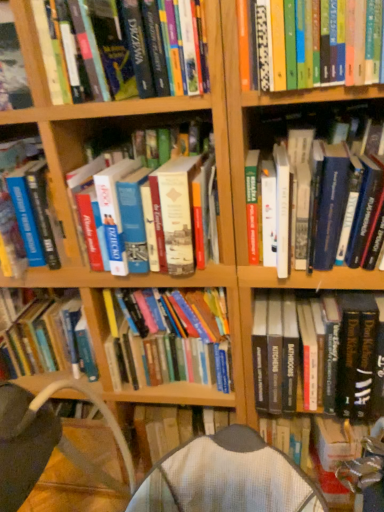
Question: From a real-world perspective, is hardcover book at upper right, which appears as the 5th book when viewed from the left, on top of hardcover book at center, which appears as the 2th book when viewed from the right?

Choices:
 (A) no
 (B) yes

Answer: (B)

Question: Is hardcover book at upper right, which is the third book in right-to-left order, oriented towards hardcover book at center, which appears as the 6th book when viewed from the left?

Choices:
 (A) yes
 (B) no

Answer: (B)

Question: Considering the relative sizes of hardcover book at upper right, which is the third book in right-to-left order, and hardcover book at center, which appears as the 2th book when viewed from the right, in the image provided, is hardcover book at upper right, which is the third book in right-to-left order, wider than hardcover book at center, which appears as the 2th book when viewed from the right,?

Choices:
 (A) yes
 (B) no

Answer: (A)

Question: Is hardcover book at upper right, which is the third book in right-to-left order, oriented away from hardcover book at center, which appears as the 2th book when viewed from the right?

Choices:
 (A) no
 (B) yes

Answer: (A)

Question: From a real-world perspective, is hardcover book at upper right, which appears as the 5th book when viewed from the left, beneath hardcover book at center, which appears as the 2th book when viewed from the right?

Choices:
 (A) no
 (B) yes

Answer: (A)

Question: Is hardcover book at upper right, which is the third book in right-to-left order, taller than hardcover book at center, which appears as the 2th book when viewed from the right?

Choices:
 (A) yes
 (B) no

Answer: (B)

Question: Is hardcover book at left, the first book viewed from the left, located outside hardcover book at lower right, the 1th book positioned from the right?

Choices:
 (A) no
 (B) yes

Answer: (B)

Question: Is hardcover book at left, the seventh book from the right, taller than hardcover book at lower right, the 1th book positioned from the right?

Choices:
 (A) no
 (B) yes

Answer: (A)

Question: From the image's perspective, is hardcover book at left, the first book viewed from the left, under hardcover book at lower right, acting as the seventh book starting from the left?

Choices:
 (A) no
 (B) yes

Answer: (A)

Question: Is hardcover book at left, the seventh book from the right, not near hardcover book at lower right, the 1th book positioned from the right?

Choices:
 (A) no
 (B) yes

Answer: (A)

Question: Is hardcover book at left, the seventh book from the right, to the right of hardcover book at lower right, acting as the seventh book starting from the left, from the viewer's perspective?

Choices:
 (A) yes
 (B) no

Answer: (B)

Question: Is hardcover book at left, the first book viewed from the left, placed right next to hardcover book at lower right, the 1th book positioned from the right?

Choices:
 (A) no
 (B) yes

Answer: (A)

Question: Considering the relative sizes of hardcover book at center, which appears as the 2th book when viewed from the right, and hardcover book at center, which is the fourth book from left to right, in the image provided, is hardcover book at center, which appears as the 2th book when viewed from the right, taller than hardcover book at center, which is the fourth book from left to right,?

Choices:
 (A) no
 (B) yes

Answer: (A)